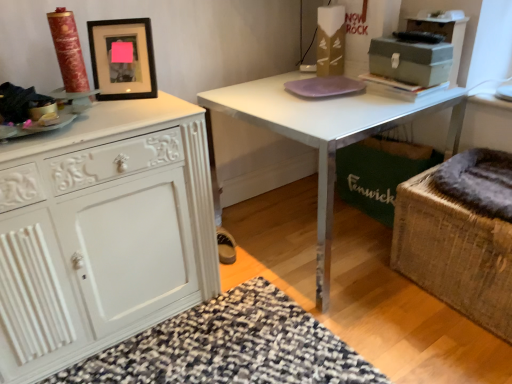
Question: From a real-world perspective, is white painted wood cabinet at left located higher than metallic gray cabinet at upper right?

Choices:
 (A) no
 (B) yes

Answer: (A)

Question: Is white painted wood cabinet at left wider than metallic gray cabinet at upper right?

Choices:
 (A) yes
 (B) no

Answer: (A)

Question: Is there a large distance between white painted wood cabinet at left and metallic gray cabinet at upper right?

Choices:
 (A) no
 (B) yes

Answer: (B)

Question: Are white painted wood cabinet at left and metallic gray cabinet at upper right making contact?

Choices:
 (A) yes
 (B) no

Answer: (B)

Question: Is white painted wood cabinet at left outside metallic gray cabinet at upper right?

Choices:
 (A) yes
 (B) no

Answer: (A)

Question: Is white painted wood cabinet at left to the right of metallic gray cabinet at upper right from the viewer's perspective?

Choices:
 (A) no
 (B) yes

Answer: (A)

Question: Is black matte picture frame at upper left thinner than dark gray plush at right, the 2th swivel chair from the bottom?

Choices:
 (A) no
 (B) yes

Answer: (B)

Question: Does black matte picture frame at upper left have a greater height compared to dark gray plush at right, the 2th swivel chair from the bottom?

Choices:
 (A) no
 (B) yes

Answer: (B)

Question: From the image's perspective, is black matte picture frame at upper left on dark gray plush at right, which ranks as the 1th swivel chair in top-to-bottom order?

Choices:
 (A) no
 (B) yes

Answer: (B)

Question: Would you consider black matte picture frame at upper left to be distant from dark gray plush at right, which ranks as the 1th swivel chair in top-to-bottom order?

Choices:
 (A) yes
 (B) no

Answer: (A)

Question: Can you confirm if black matte picture frame at upper left is positioned to the left of dark gray plush at right, which ranks as the 1th swivel chair in top-to-bottom order?

Choices:
 (A) yes
 (B) no

Answer: (A)

Question: Is black matte picture frame at upper left outside of dark gray plush at right, the 2th swivel chair from the bottom?

Choices:
 (A) yes
 (B) no

Answer: (A)

Question: Is dark gray plush at right, the 2th swivel chair from the bottom, further to the viewer compared to purple glass plate at center?

Choices:
 (A) yes
 (B) no

Answer: (B)